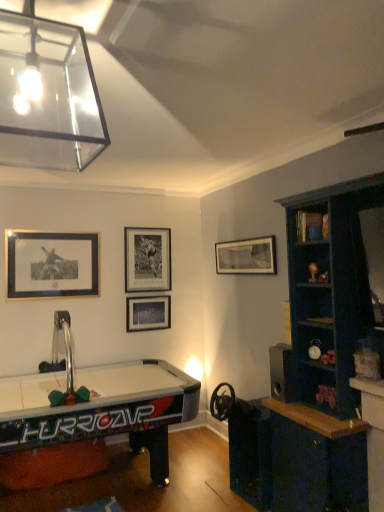
Question: Relative to gold metallic picture frame at upper left, marked as the 4th picture frame in a right-to-left arrangement, is matte black picture frame at center, the third picture frame in the left-to-right sequence, in front or behind?

Choices:
 (A) behind
 (B) front

Answer: (A)

Question: In terms of size, does matte black picture frame at center, positioned as the second picture frame in right-to-left order, appear bigger or smaller than gold metallic picture frame at upper left, the 1th picture frame from the left?

Choices:
 (A) big
 (B) small

Answer: (B)

Question: Which of these objects is positioned closest to the gold metallic picture frame at upper left, the 1th picture frame from the left?

Choices:
 (A) metallic silver air hockey table at lower left
 (B) clear glass pendant light at upper left
 (C) black matte picture frame at upper center, the 3th picture frame viewed from the right
 (D) wooden bookshelf at upper right
 (E) black matte picture frame at upper center, placed as the fourth picture frame when sorted from left to right

Answer: (C)

Question: Estimate the real-world distances between objects in this image. Which object is farther from the wooden bookshelf at upper right?

Choices:
 (A) clear glass pendant light at upper left
 (B) matte black picture frame at center, the third picture frame in the left-to-right sequence
 (C) metallic silver air hockey table at lower left
 (D) black matte picture frame at upper center, marked as the 1th picture frame in a right-to-left arrangement
 (E) gold metallic picture frame at upper left, marked as the 4th picture frame in a right-to-left arrangement

Answer: (E)